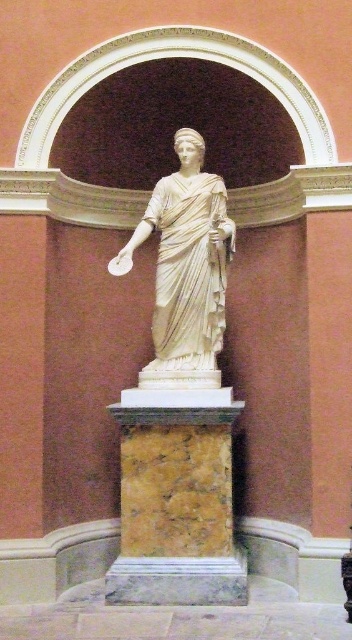
You are an art conservator examining the classical marble statue and its pedestal. You need to determine the spatial relationship between the marble pedestal at center and the white marble statue at center. Which object is positioned to the left?

The marble pedestal at center is to the left of the white marble statue at center according to the description.

You are an art conservator examining the classical marble statue and its pedestal. From your vantage point, which object is nearer to you between the marble pedestal at center and the white marble statue at center?

The marble pedestal at center is closer to the viewer than the white marble statue at center.